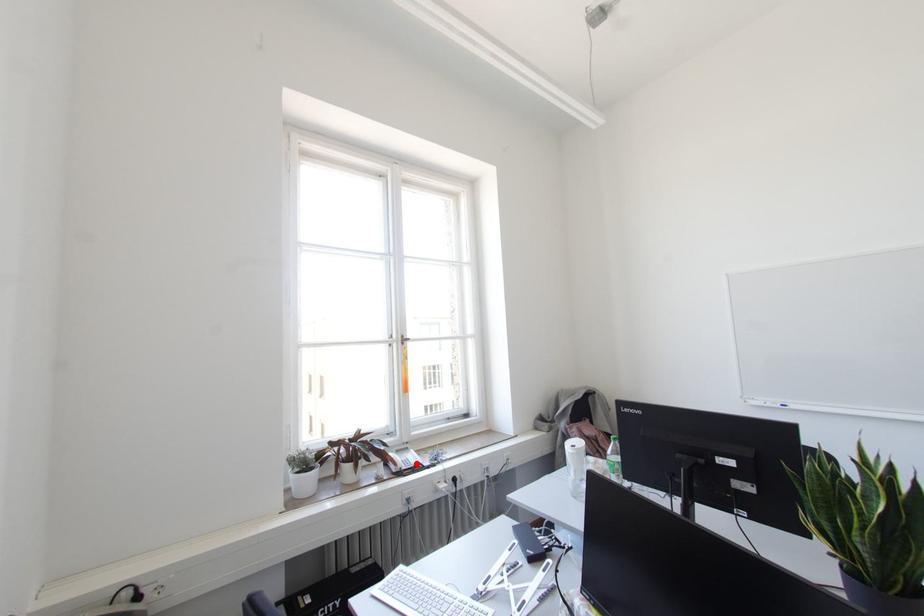
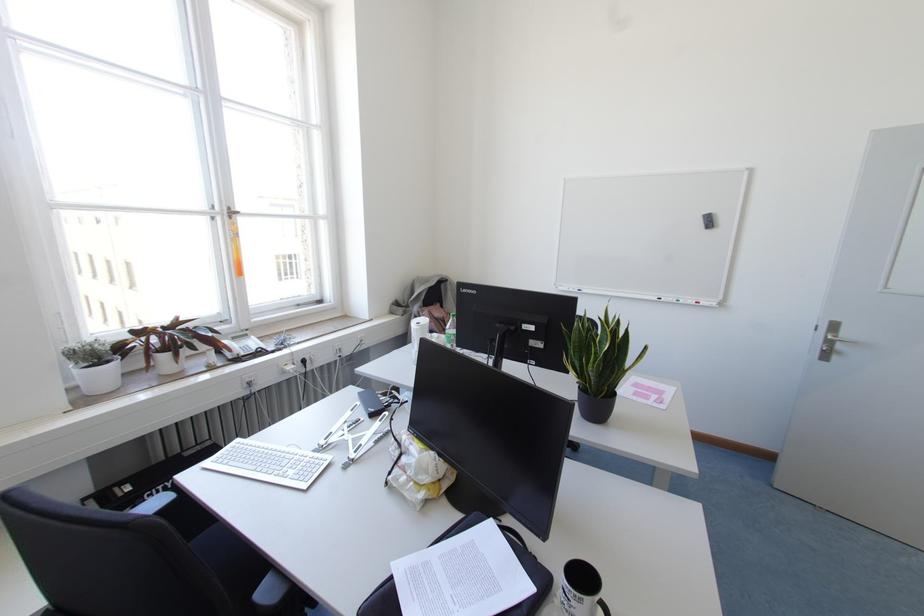
Locate, in the second image, the point that corresponds to the highlighted location in the first image.

(258, 349)